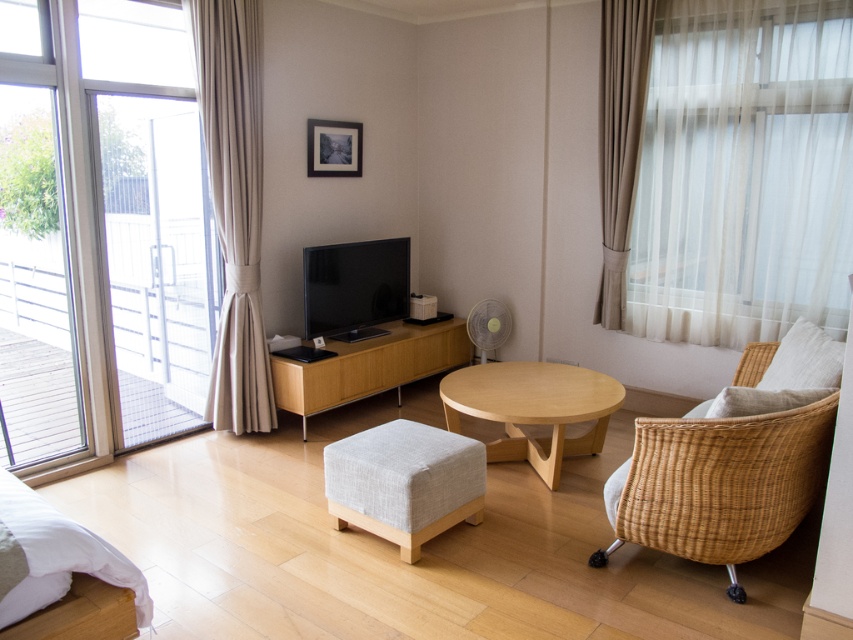
Question: Which of the following is the farthest from the observer?

Choices:
 (A) (619, 154)
 (B) (364, 484)
 (C) (798, 458)
 (D) (561, 442)

Answer: (A)

Question: Can you confirm if sheer white curtain at right is positioned to the right of satin beige curtain at left?

Choices:
 (A) no
 (B) yes

Answer: (B)

Question: Which of the following is the farthest from the observer?

Choices:
 (A) light gray fabric stool at center
 (B) clear glass door at left
 (C) woven wicker armchair at right
 (D) wooden coffee table at center

Answer: (D)

Question: Can you confirm if woven wicker armchair at right is positioned to the right of satin beige curtain at left?

Choices:
 (A) no
 (B) yes

Answer: (B)

Question: Does light gray fabric stool at center appear over beige fabric curtain at right?

Choices:
 (A) no
 (B) yes

Answer: (A)

Question: Which point appears closest to the camera in this image?

Choices:
 (A) (387, 342)
 (B) (503, 369)
 (C) (804, 186)

Answer: (C)